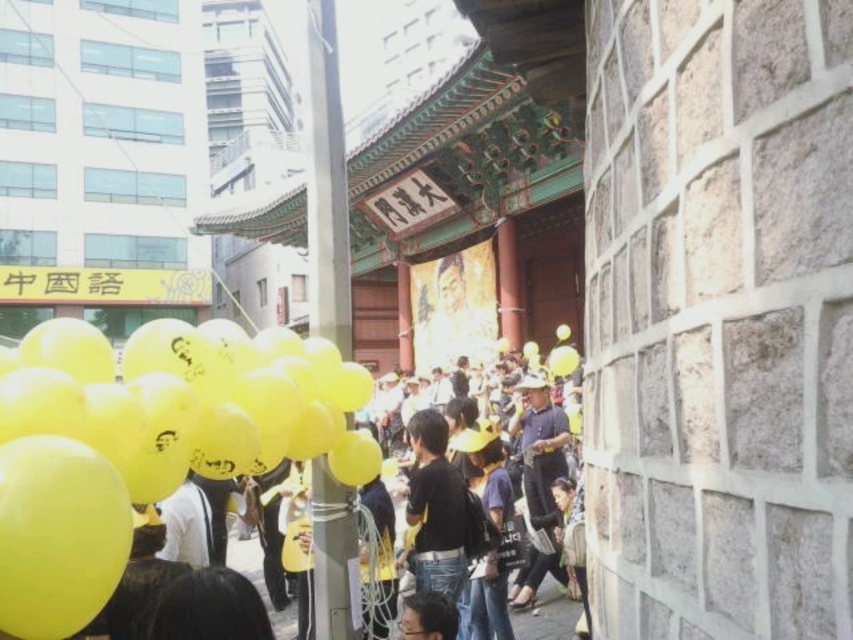
Is yellow matte balloon at center shorter than black matte shirt at center?

Correct, yellow matte balloon at center is not as tall as black matte shirt at center.

Between point (230, 472) and point (416, 467), which one is positioned behind?

Point (416, 467)

Identify the location of yellow matte balloon at center. (146, 442).

Does point (115, 376) lie in front of point (325, 328)?

Yes, it is in front of point (325, 328).

Who is more distant from viewer, [189,337] or [329,301]?

Positioned behind is point [329,301].

You are a GUI agent. You are given a task and a screenshot of the screen. Output one action in this format:
    pyautogui.click(x=<x>, y=<y>)
    Task: Click on the yellow matte balloon at center
    
    Given the screenshot: What is the action you would take?
    pyautogui.click(x=146, y=442)

Is point (457, 548) more distant than point (538, 497)?

No, it is not.

At what (x,y) coordinates should I click in order to perform the action: click on black matte shirt at center. Please return your answer as a coordinate pair (x, y). Image resolution: width=853 pixels, height=640 pixels. Looking at the image, I should click on (436, 513).

Where is `black matte shirt at center`? black matte shirt at center is located at coordinates (436, 513).